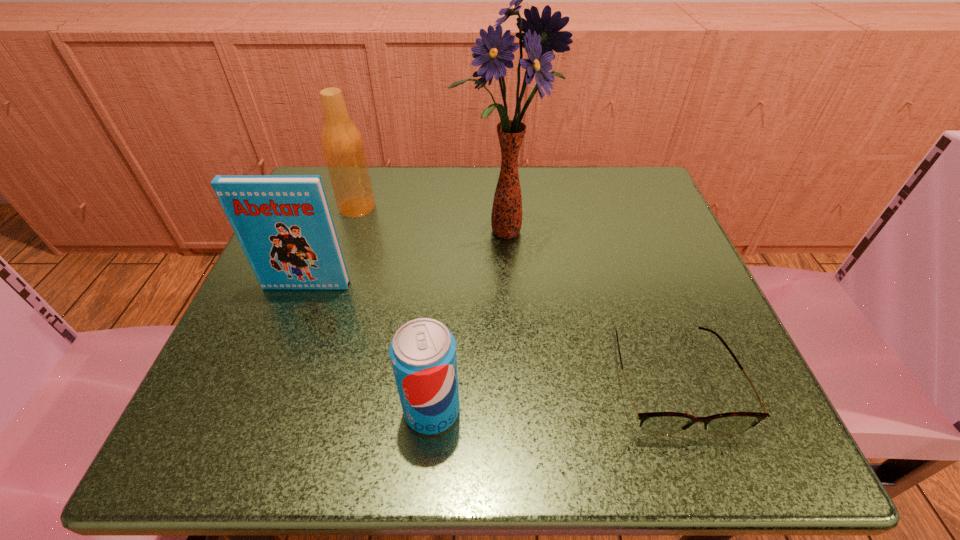
Find the location of a particular element. vacant area that lies between the soda can and the book is located at coordinates (370, 348).

Locate an element on the screen. This screenshot has width=960, height=540. free area in between the soda can and the beer bottle is located at coordinates (395, 309).

Identify the location of empty space between the beer bottle and the soda can. (395, 309).

The image size is (960, 540). I want to click on object that is the second closest to the shortest object, so click(x=423, y=351).

Select which object appears as the closest to the rightmost object. Please provide its 2D coordinates. Your answer should be formatted as a tuple, i.e. [(x, y)], where the tuple contains the x and y coordinates of a point satisfying the conditions above.

[(541, 36)]

Where is `free spot that satisfies the following two spatial constraints: 1. on the front cover of the book; 2. on the right side of the soda can`? This screenshot has width=960, height=540. free spot that satisfies the following two spatial constraints: 1. on the front cover of the book; 2. on the right side of the soda can is located at coordinates 259,410.

You are a GUI agent. You are given a task and a screenshot of the screen. Output one action in this format:
    pyautogui.click(x=<x>, y=<y>)
    Task: Click on the vacant space that satisfies the following two spatial constraints: 1. on the front side of the beer bottle; 2. on the right side of the flower arrangement
    The image size is (960, 540).
    Given the screenshot: What is the action you would take?
    pyautogui.click(x=349, y=232)

Locate an element on the screen. The height and width of the screenshot is (540, 960). vacant point that satisfies the following two spatial constraints: 1. on the front cover of the second shortest object; 2. on the right side of the third nearest object is located at coordinates (259, 410).